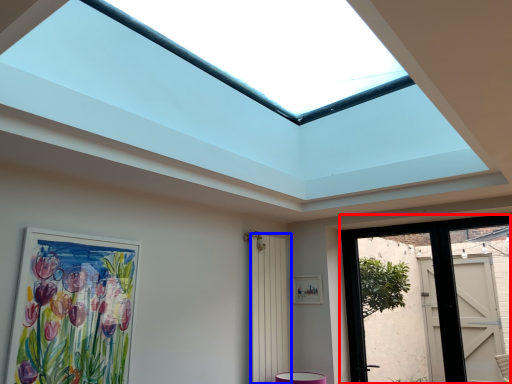
Question: Among these objects, which one is nearest to the camera, door (highlighted by a red box) or screen door (highlighted by a blue box)?

Choices:
 (A) door
 (B) screen door

Answer: (A)